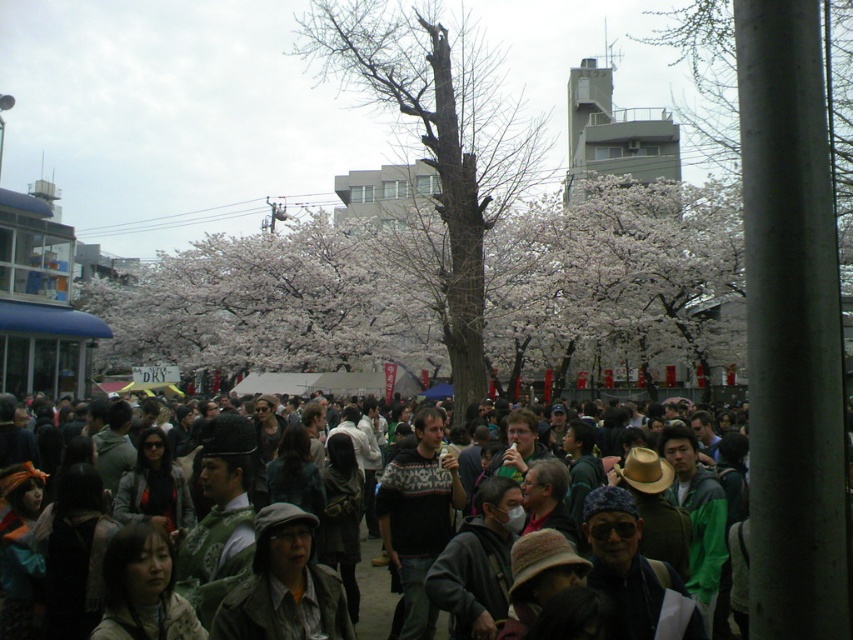
Question: Which is nearer to the dark gray jacket at center?

Choices:
 (A) white blossoms at center
 (B) bare wood tree at center

Answer: (B)

Question: Which object appears farthest from the camera in this image?

Choices:
 (A) dark gray jacket at center
 (B) white blossoms at center
 (C) bare wood tree at center

Answer: (C)

Question: Which object is positioned closest to the bare wood tree at center?

Choices:
 (A) dark gray jacket at center
 (B) white blossoms at center

Answer: (B)

Question: Can you confirm if white blossoms at center is bigger than dark gray jacket at center?

Choices:
 (A) yes
 (B) no

Answer: (A)

Question: Is bare wood tree at center positioned in front of dark gray jacket at center?

Choices:
 (A) yes
 (B) no

Answer: (B)

Question: Does bare wood tree at center appear over white blossoms at center?

Choices:
 (A) yes
 (B) no

Answer: (A)